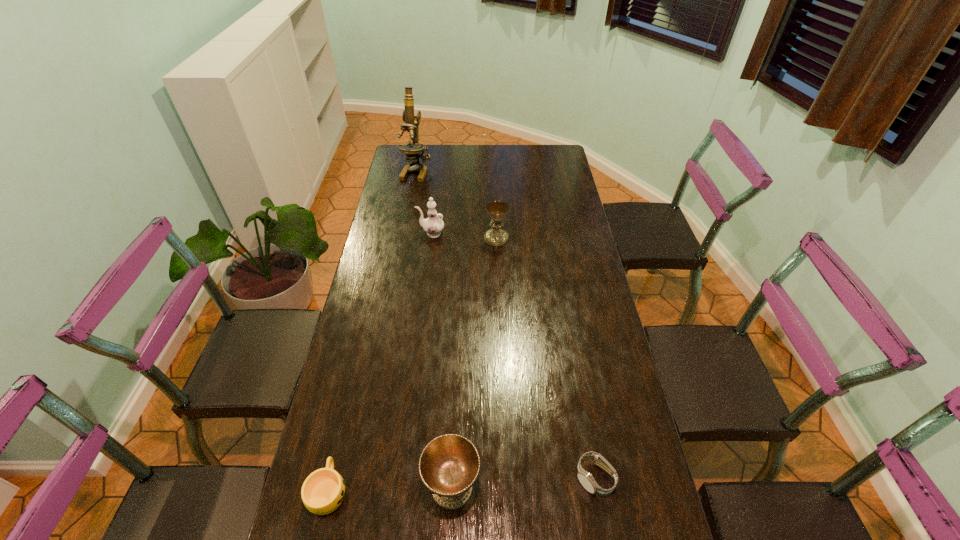
Find the location of `free spot between the chinaware and the microscope`. free spot between the chinaware and the microscope is located at coordinates (424, 202).

I want to click on vacant space in between the nearer chalice and the cup, so click(391, 489).

Locate which object ranks second in proximity to the rightmost object. Please provide its 2D coordinates. Your answer should be formatted as a tuple, i.e. [(x, y)], where the tuple contains the x and y coordinates of a point satisfying the conditions above.

[(323, 491)]

Find the location of a particular element. the third closest object to the farther chalice is located at coordinates (449, 465).

Locate an element on the screen. The height and width of the screenshot is (540, 960). free region that satisfies the following two spatial constraints: 1. on the front side of the farthest object; 2. on the right side of the left chalice is located at coordinates (357, 487).

This screenshot has height=540, width=960. What are the coordinates of `blank space that satisfies the following two spatial constraints: 1. at the spout of the third object from right to left; 2. on the left side of the chinaware` in the screenshot? It's located at (400, 487).